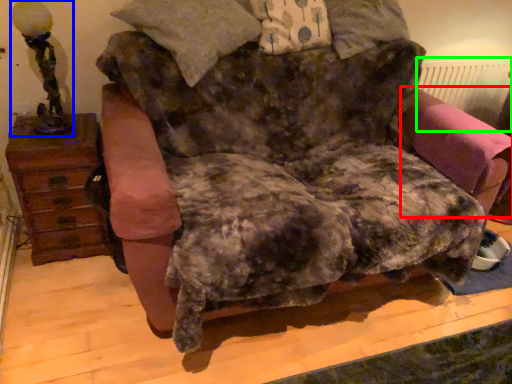
Question: Based on their relative distances, which object is farther from swivel chair (highlighted by a red box)? Choose from table lamp (highlighted by a blue box) and radiator (highlighted by a green box).

Choices:
 (A) table lamp
 (B) radiator

Answer: (A)